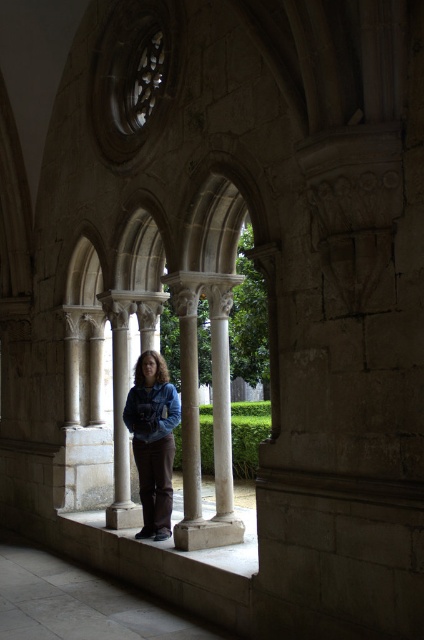
Question: Which of the following is the farthest from the observer?

Choices:
 (A) (204, 544)
 (B) (173, 412)
 (C) (228, 548)

Answer: (B)

Question: Does white stone column at center appear on the right side of blue denim jacket at center?

Choices:
 (A) yes
 (B) no

Answer: (A)

Question: Which object appears farthest from the camera in this image?

Choices:
 (A) white stone column at center
 (B) denim jacket at center
 (C) white stone ledge at center
 (D) blue denim jacket at center

Answer: (B)

Question: Which point is farther to the camera?

Choices:
 (A) (215, 451)
 (B) (75, 515)

Answer: (B)

Question: Can you confirm if blue denim jacket at center is thinner than white stone ledge at center?

Choices:
 (A) no
 (B) yes

Answer: (A)

Question: Can you confirm if white stone column at center is thinner than denim jacket at center?

Choices:
 (A) no
 (B) yes

Answer: (A)